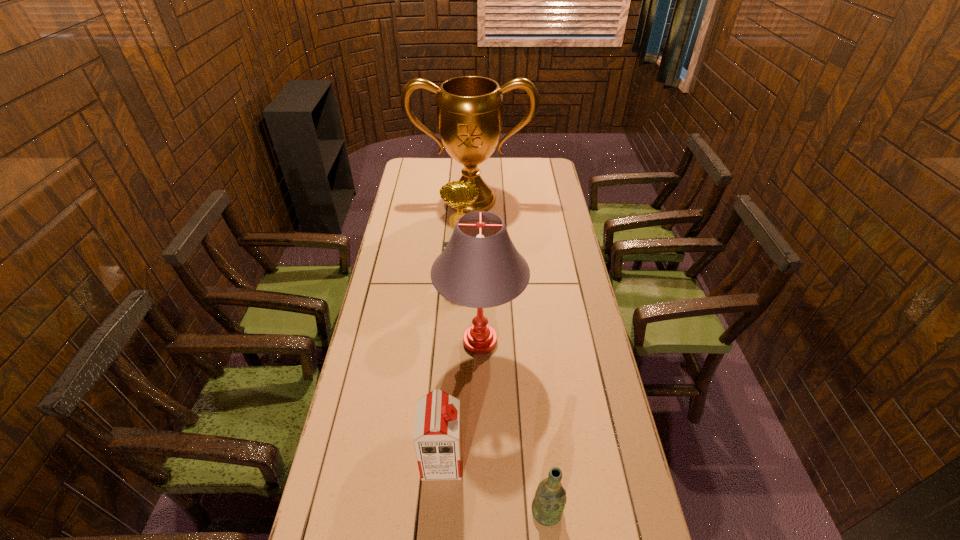
Locate an element on the screen. vacant space at the far left corner of the desktop is located at coordinates (428, 178).

The height and width of the screenshot is (540, 960). Identify the location of empty space between the fourth shortest object and the soya milk. (462, 401).

Where is `free spot between the beer bottle and the award`? free spot between the beer bottle and the award is located at coordinates coord(504,387).

Locate an element on the screen. The width and height of the screenshot is (960, 540). unoccupied area between the second nearest object and the second tallest object is located at coordinates (462, 401).

You are a GUI agent. You are given a task and a screenshot of the screen. Output one action in this format:
    pyautogui.click(x=<x>, y=<y>)
    Task: Click on the blank region between the table lamp and the shortest object
    The height and width of the screenshot is (540, 960).
    Given the screenshot: What is the action you would take?
    click(x=514, y=426)

I want to click on unoccupied area between the trophy cup and the nearest object, so click(509, 355).

Identify which object is located as the third nearest to the third farthest object. Please provide its 2D coordinates. Your answer should be formatted as a tuple, i.e. [(x, y)], where the tuple contains the x and y coordinates of a point satisfying the conditions above.

[(548, 505)]

Identify which object is located as the second nearest to the farthest object. Please provide its 2D coordinates. Your answer should be formatted as a tuple, i.e. [(x, y)], where the tuple contains the x and y coordinates of a point satisfying the conditions above.

[(480, 267)]